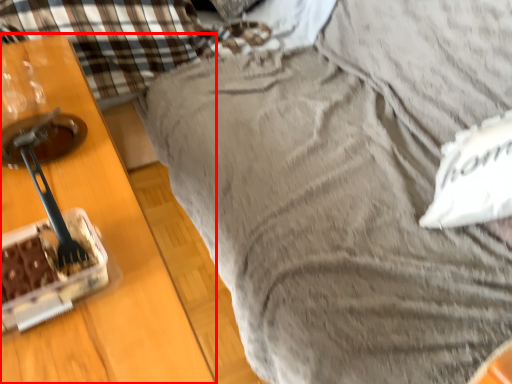
Question: From the image's perspective, what is the correct spatial positioning of furniture (annotated by the red box) in reference to pillow?

Choices:
 (A) above
 (B) below

Answer: (B)